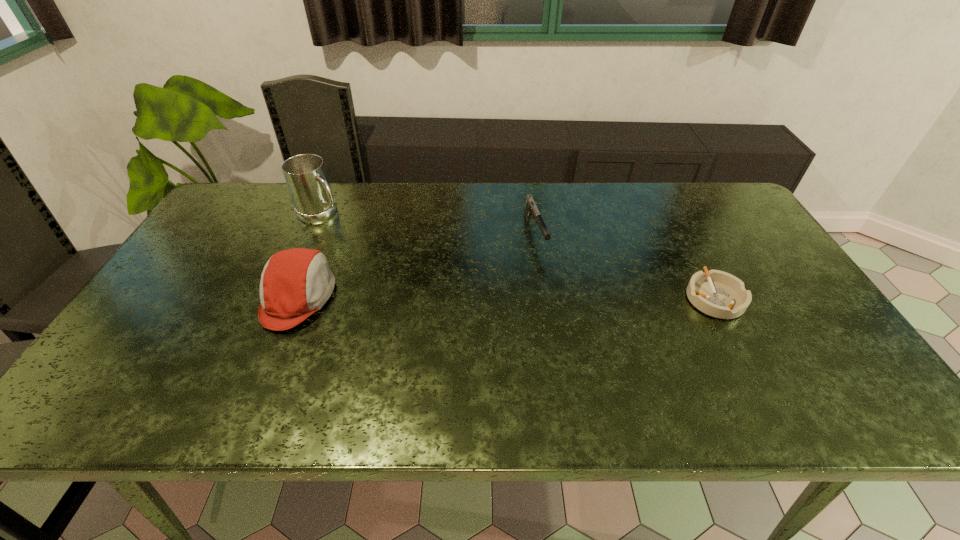
Where is `the second closest object to the shortest object`? the second closest object to the shortest object is located at coordinates (295, 283).

Where is `object that is the third closest to the second tallest object`? object that is the third closest to the second tallest object is located at coordinates (716, 293).

Find the location of a particular element. This screenshot has height=540, width=960. free point that satisfies the following two spatial constraints: 1. on the front side of the second shortest object; 2. on the left side of the mug is located at coordinates (313, 233).

You are a GUI agent. You are given a task and a screenshot of the screen. Output one action in this format:
    pyautogui.click(x=<x>, y=<y>)
    Task: Click on the free spot that satisfies the following two spatial constraints: 1. on the front side of the third tallest object; 2. on the left side of the mug
    
    Given the screenshot: What is the action you would take?
    pyautogui.click(x=313, y=233)